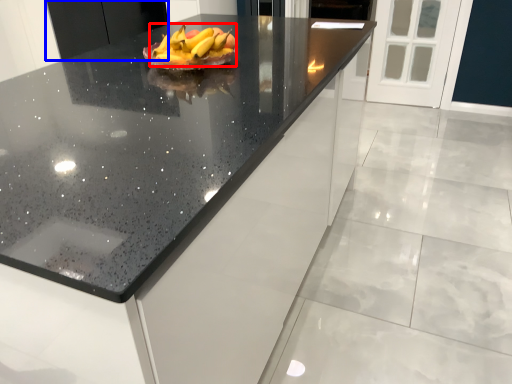
Question: Which of the following is the closest to the observer, grapefruit (highlighted by a red box) or cabinetry (highlighted by a blue box)?

Choices:
 (A) grapefruit
 (B) cabinetry

Answer: (A)